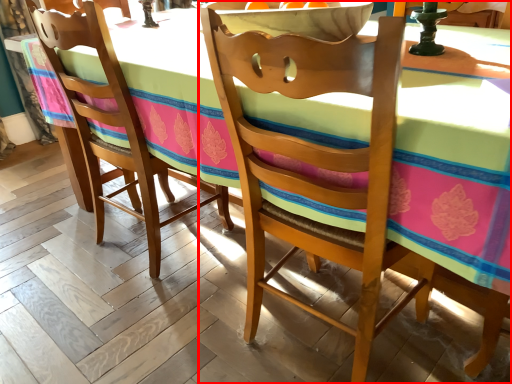
Question: Observing the image, what is the correct spatial positioning of chair (annotated by the red box) in reference to chair?

Choices:
 (A) left
 (B) right

Answer: (B)